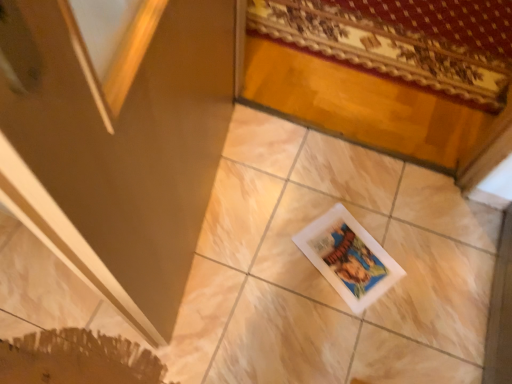
The width and height of the screenshot is (512, 384). I want to click on vacant area that is in front of white matte picture frame at center, so click(x=343, y=335).